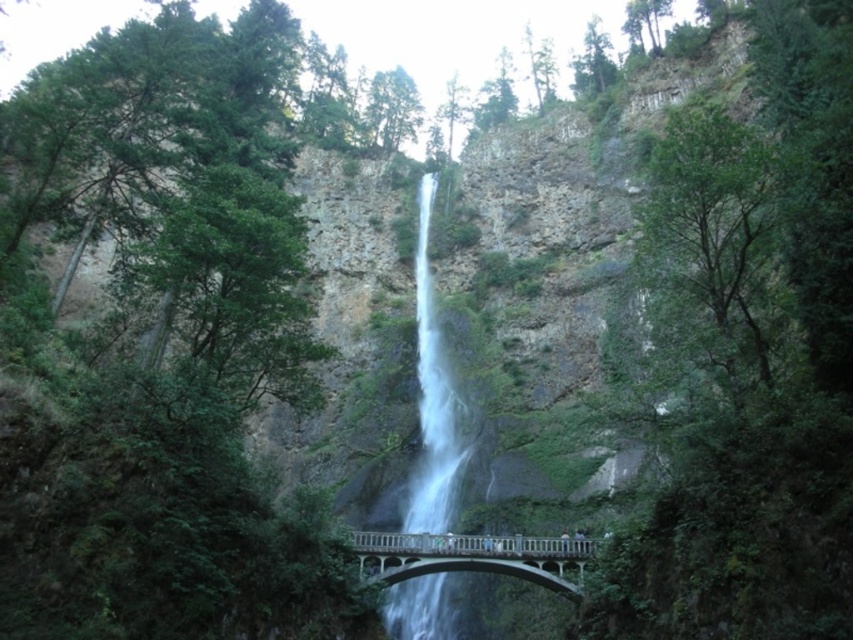
You are planning to cross the white concrete bridge at center while avoiding the white frothy water at center. Can you safely walk on the bridge without stepping into the water?

The white frothy water at center is narrower than the white concrete bridge at center, so yes, you can safely walk on the bridge without stepping into the water.

You are a hiker who wants to cross the white concrete bridge at center to get to the other side. However, you notice the white frothy water at center nearby. Is the bridge big enough for you to safely cross without getting wet?

The white frothy water at center is larger in size than the white concrete bridge at center, so the bridge may not be wide enough to avoid the water. It might be risky to cross safely without getting wet.

You are a hiker standing on the white concrete bridge at center. Looking up, you see the white frothy water at center. Can you determine if the water is flowing towards or away from the bridge?

The white frothy water at center is located above the white concrete bridge at center, so the water is flowing downward from above the bridge, meaning it is flowing away from the bridge towards the lower areas.